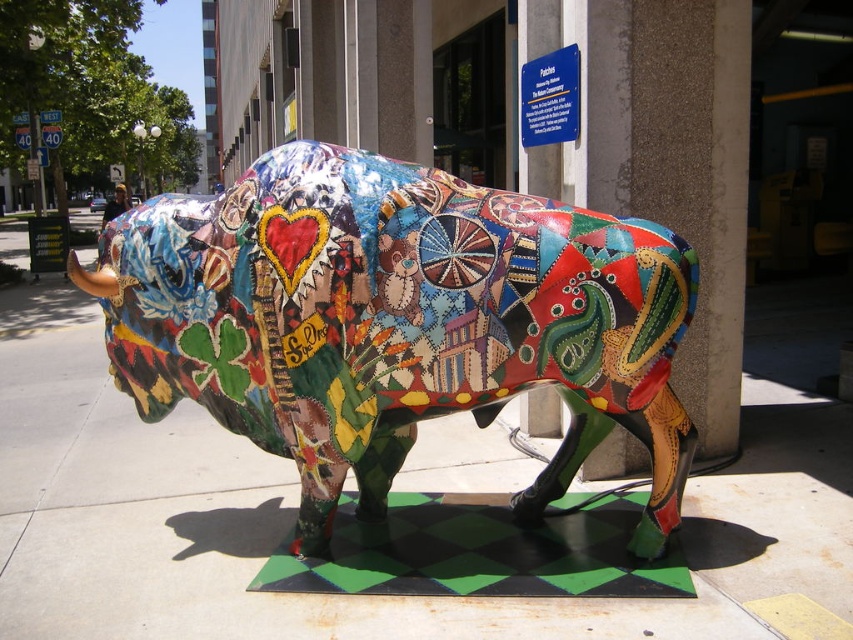
Who is more forward, (460, 236) or (622, 552)?

Point (460, 236) is more forward.

Does point (596, 378) come closer to viewer compared to point (508, 532)?

Yes.

Identify the location of multicolored mosaic bull at center. (396, 321).